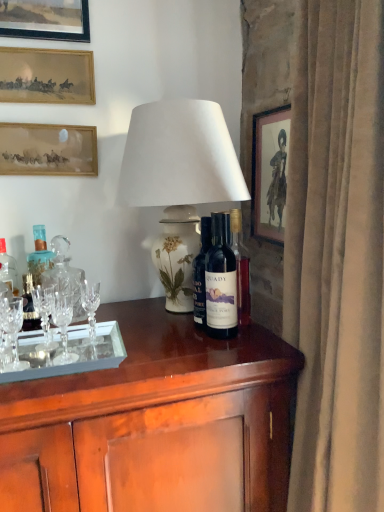
What is the approximate width of beige fabric curtain at right?

It is 12.74 inches.

What is the approximate height of wooden framed picture at upper right, the fourth picture frame viewed from the top?

It is 15.46 inches.

Describe the element at coordinates (221, 280) in the screenshot. This screenshot has height=512, width=384. I see `dark blue glass bottle at center, which appears as the 1th bottle when viewed from the right` at that location.

Locate an element on the screen. The width and height of the screenshot is (384, 512). matte gold picture frame at upper left, which is counted as the third picture frame, starting from the bottom is located at coordinates (46, 76).

Who is bigger, clear crystal wine glass at left or beige fabric curtain at right?

beige fabric curtain at right is bigger.

Is clear crystal wine glass at left shorter than beige fabric curtain at right?

Yes.

Looking at their sizes, would you say clear crystal wine glass at left is wider or thinner than beige fabric curtain at right?

In the image, clear crystal wine glass at left appears to be more narrow than beige fabric curtain at right.

Does white ceramic lamp at center have a greater width compared to dark blue glass bottle at center, which is counted as the third bottle, starting from the left?

Yes, white ceramic lamp at center is wider than dark blue glass bottle at center, which is counted as the third bottle, starting from the left.

Can you confirm if white ceramic lamp at center is bigger than dark blue glass bottle at center, which is counted as the third bottle, starting from the left?

Yes, white ceramic lamp at center is bigger than dark blue glass bottle at center, which is counted as the third bottle, starting from the left.

Is point (164, 220) positioned before point (223, 309)?

No.

Which is more to the right, wooden picture frame at upper left, which is the 4th picture frame in bottom-to-top order, or glossy wood desk at center?

glossy wood desk at center.

Is wooden picture frame at upper left, acting as the fourth picture frame starting from the right, wider than glossy wood desk at center?

No, wooden picture frame at upper left, acting as the fourth picture frame starting from the right, is not wider than glossy wood desk at center.

Do you think wooden picture frame at upper left, which appears as the 1th picture frame when viewed from the top, is within glossy wood desk at center, or outside of it?

wooden picture frame at upper left, which appears as the 1th picture frame when viewed from the top, is outside glossy wood desk at center.

Who is taller, wooden picture frame at upper left, acting as the fourth picture frame starting from the right, or glossy wood desk at center?

glossy wood desk at center.

Is glossy wood desk at center facing away from clear glass bottle at left, arranged as the 1th bottle when viewed from the left?

No, glossy wood desk at center is not facing away from clear glass bottle at left, arranged as the 1th bottle when viewed from the left.

Looking at this image, which object is closer to the camera, glossy wood desk at center or clear glass bottle at left, acting as the third bottle starting from the right?

glossy wood desk at center is closer to the camera.

From a real-world perspective, is glossy wood desk at center positioned above or below clear glass bottle at left, acting as the third bottle starting from the right?

Clearly, from a real-world perspective, glossy wood desk at center is below clear glass bottle at left, acting as the third bottle starting from the right.

Can you confirm if wooden framed picture at upper right, the fourth picture frame viewed from the top, is bigger than clear glass bottle at left, arranged as the 1th bottle when viewed from the left?

Indeed, wooden framed picture at upper right, the fourth picture frame viewed from the top, has a larger size compared to clear glass bottle at left, arranged as the 1th bottle when viewed from the left.

How many degrees apart are the facing directions of wooden framed picture at upper right, the 4th picture frame from the left, and clear glass bottle at left, acting as the third bottle starting from the right?

The facing directions of wooden framed picture at upper right, the 4th picture frame from the left, and clear glass bottle at left, acting as the third bottle starting from the right, are 90.1 degrees apart.

Is wooden framed picture at upper right, the first picture frame when ordered from bottom to top, facing towards clear glass bottle at left, acting as the third bottle starting from the right?

Yes, wooden framed picture at upper right, the first picture frame when ordered from bottom to top, is facing clear glass bottle at left, acting as the third bottle starting from the right.

Which object is wider, wooden framed picture at upper right, the first picture frame when ordered from bottom to top, or clear glass bottle at left, arranged as the 1th bottle when viewed from the left?

Wider between the two is clear glass bottle at left, arranged as the 1th bottle when viewed from the left.

Would you say clear crystal wine glass at left is a long distance from wooden framed picture at upper right, the fourth picture frame viewed from the top?

No, clear crystal wine glass at left is not far away from wooden framed picture at upper right, the fourth picture frame viewed from the top.

Who is shorter, clear crystal wine glass at left or wooden framed picture at upper right, the fourth picture frame viewed from the top?

Standing shorter between the two is clear crystal wine glass at left.

Is point (14, 325) behind point (286, 156)?

No, (14, 325) is in front of (286, 156).

From the image's perspective, is clear crystal wine glass at left over wooden framed picture at upper right, which is the first picture frame from right to left?

No, from the image's perspective, clear crystal wine glass at left is not over wooden framed picture at upper right, which is the first picture frame from right to left.

Does point (229, 165) come in front of point (199, 273)?

Yes, point (229, 165) is in front of point (199, 273).

Considering the sizes of objects white ceramic lamp at center and dark blue glass bottle at center, the 2th bottle viewed from the left, in the image provided, who is smaller, white ceramic lamp at center or dark blue glass bottle at center, the 2th bottle viewed from the left,?

dark blue glass bottle at center, the 2th bottle viewed from the left, is smaller.

Considering the positions of objects white ceramic lamp at center and dark blue glass bottle at center, placed as the second bottle when sorted from right to left, in the image provided, who is more to the left, white ceramic lamp at center or dark blue glass bottle at center, placed as the second bottle when sorted from right to left,?

Positioned to the left is white ceramic lamp at center.

Where is `wine glass directly beneath the beige fabric curtain at right (from a real-world perspective)`? Image resolution: width=384 pixels, height=512 pixels. wine glass directly beneath the beige fabric curtain at right (from a real-world perspective) is located at coordinates (13, 329).

The image size is (384, 512). What are the coordinates of `lamp above the dark blue glass bottle at center, which is counted as the third bottle, starting from the left (from a real-world perspective)` in the screenshot? It's located at (179, 175).

Based on their spatial positions, is matte wooden picture frame at upper left, marked as the second picture frame in a left-to-right arrangement, or dark blue glass bottle at center, which appears as the 1th bottle when viewed from the right, further from clear crystal wine glass at left?

dark blue glass bottle at center, which appears as the 1th bottle when viewed from the right, is further to clear crystal wine glass at left.

Which object lies nearer to the anchor point matte wooden picture frame at upper left, marked as the second picture frame in a left-to-right arrangement, dark blue glass bottle at center, placed as the second bottle when sorted from right to left, or white ceramic lamp at center?

white ceramic lamp at center is closer to matte wooden picture frame at upper left, marked as the second picture frame in a left-to-right arrangement.

When comparing their distances from white ceramic lamp at center, does dark blue glass bottle at center or wooden framed picture at upper right, the 4th picture frame from the left, seem closer?

Among the two, dark blue glass bottle at center is located nearer to white ceramic lamp at center.

From the image, which object appears to be nearer to glossy wood desk at center, matte wooden picture frame at upper left, which ranks as the 3th picture frame in right-to-left order, or matte gold picture frame at upper left, which is counted as the third picture frame, starting from the bottom?

matte wooden picture frame at upper left, which ranks as the 3th picture frame in right-to-left order, lies closer to glossy wood desk at center than the other object.

When comparing their distances from dark blue glass bottle at center, does clear crystal wine glass at left or white ceramic lamp at center seem further?

clear crystal wine glass at left is further to dark blue glass bottle at center.

Which object lies nearer to the anchor point dark blue glass bottle at center, which is counted as the third bottle, starting from the left, clear glass bottle at left, acting as the third bottle starting from the right, or clear crystal wine glass at left?

clear crystal wine glass at left.

Considering their positions, is dark blue glass bottle at center, the 2th bottle viewed from the left, positioned closer to wooden picture frame at upper left, which appears as the 1th picture frame when viewed from the top, than wooden framed picture at upper right, the 4th picture frame from the left?

wooden framed picture at upper right, the 4th picture frame from the left, is closer to wooden picture frame at upper left, which appears as the 1th picture frame when viewed from the top.

From the image, which object appears to be nearer to matte gold picture frame at upper left, which is counted as the third picture frame, starting from the bottom, dark blue glass bottle at center or wooden picture frame at upper left, the first picture frame in the left-to-right sequence?

wooden picture frame at upper left, the first picture frame in the left-to-right sequence, is closer to matte gold picture frame at upper left, which is counted as the third picture frame, starting from the bottom.

This screenshot has height=512, width=384. I want to click on curtain between wooden picture frame at upper left, which is the 4th picture frame in bottom-to-top order, and clear crystal wine glass at left, in the vertical direction, so (x=337, y=256).

You are a GUI agent. You are given a task and a screenshot of the screen. Output one action in this format:
    pyautogui.click(x=<x>, y=<y>)
    Task: Click on the wine tasting located between white ceramic lamp at center and wooden framed picture at upper right, which is the first picture frame from right to left, in the left-right direction
    The width and height of the screenshot is (384, 512).
    Given the screenshot: What is the action you would take?
    pyautogui.click(x=222, y=280)

Where is `desk located between clear glass bottle at left, acting as the third bottle starting from the right, and dark blue glass bottle at center in the left-right direction`? desk located between clear glass bottle at left, acting as the third bottle starting from the right, and dark blue glass bottle at center in the left-right direction is located at coordinates (156, 423).

The image size is (384, 512). In order to click on lamp located between matte wooden picture frame at upper left, which ranks as the 3th picture frame in right-to-left order, and dark blue glass bottle at center, placed as the second bottle when sorted from right to left, in the left-right direction in this screenshot , I will do `click(179, 175)`.